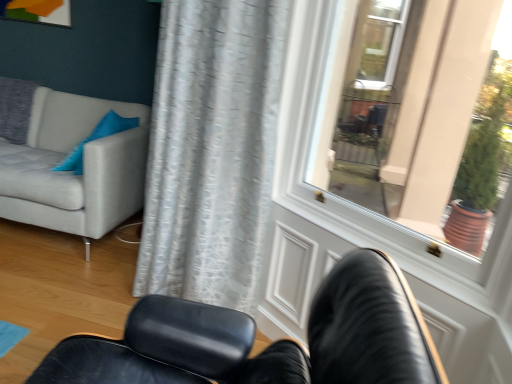
Question: Does white glossy door at upper right have a lesser width compared to light gray fabric couch at left?

Choices:
 (A) no
 (B) yes

Answer: (B)

Question: Is white glossy door at upper right taller than light gray fabric couch at left?

Choices:
 (A) yes
 (B) no

Answer: (A)

Question: Is white glossy door at upper right oriented towards light gray fabric couch at left?

Choices:
 (A) no
 (B) yes

Answer: (A)

Question: From the image's perspective, is white glossy door at upper right on top of light gray fabric couch at left?

Choices:
 (A) no
 (B) yes

Answer: (A)

Question: Is white glossy door at upper right to the right of light gray fabric couch at left from the viewer's perspective?

Choices:
 (A) yes
 (B) no

Answer: (A)

Question: From the image's perspective, would you say white glossy door at upper right is shown under light gray fabric couch at left?

Choices:
 (A) no
 (B) yes

Answer: (B)

Question: Is light gray fabric couch at left smaller than blue fabric pillow at upper left?

Choices:
 (A) no
 (B) yes

Answer: (A)

Question: From the image's perspective, does light gray fabric couch at left appear higher than blue fabric pillow at upper left?

Choices:
 (A) yes
 (B) no

Answer: (B)

Question: Is light gray fabric couch at left not close to blue fabric pillow at upper left?

Choices:
 (A) yes
 (B) no

Answer: (B)

Question: Can you confirm if light gray fabric couch at left is positioned to the left of blue fabric pillow at upper left?

Choices:
 (A) no
 (B) yes

Answer: (B)

Question: Does light gray fabric couch at left come in front of blue fabric pillow at upper left?

Choices:
 (A) no
 (B) yes

Answer: (B)

Question: From a real-world perspective, does light gray fabric couch at left sit lower than blue fabric pillow at upper left?

Choices:
 (A) no
 (B) yes

Answer: (B)

Question: Considering the relative sizes of white glossy door at upper right and black leather chair at lower center in the image provided, is white glossy door at upper right smaller than black leather chair at lower center?

Choices:
 (A) yes
 (B) no

Answer: (A)